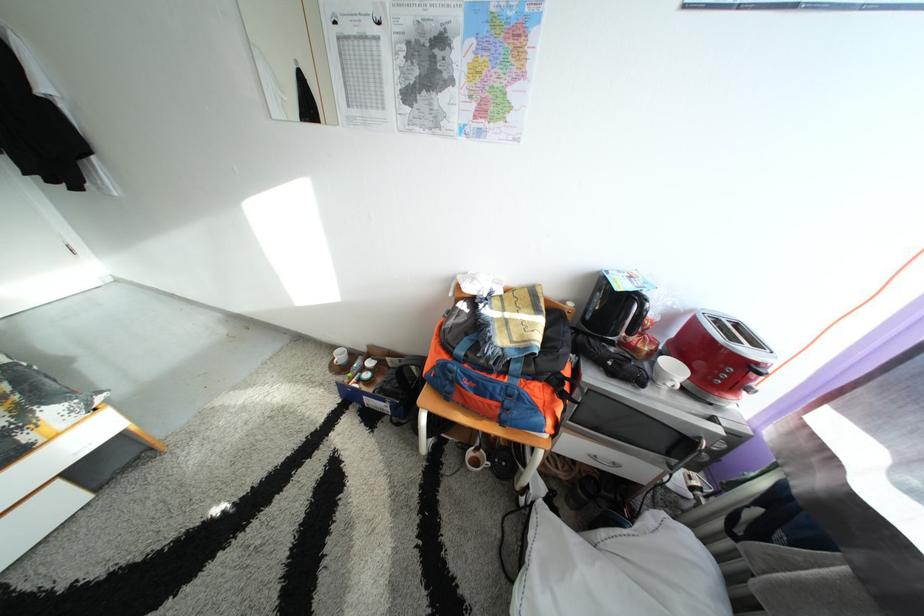
Where would you push the toaster lever? Please return your answer as a coordinate pair (x, y).

(758, 370)